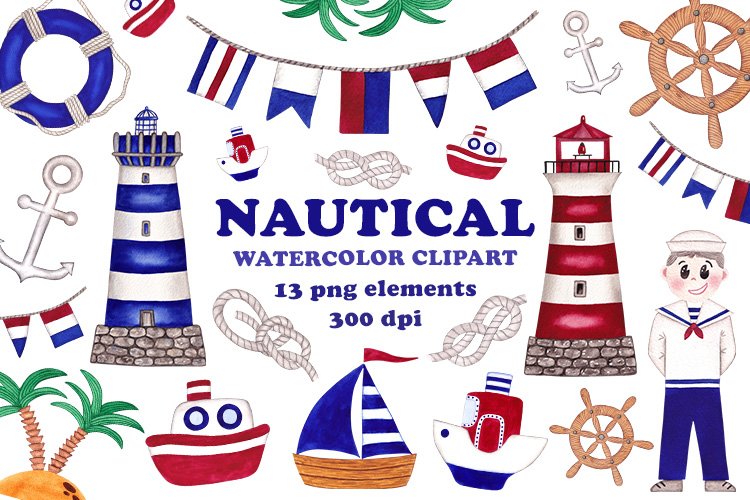
Image resolution: width=750 pixels, height=500 pixels. In order to click on window in this screenshot , I will do `click(147, 180)`, `click(145, 227)`, `click(580, 235)`, `click(578, 287)`.